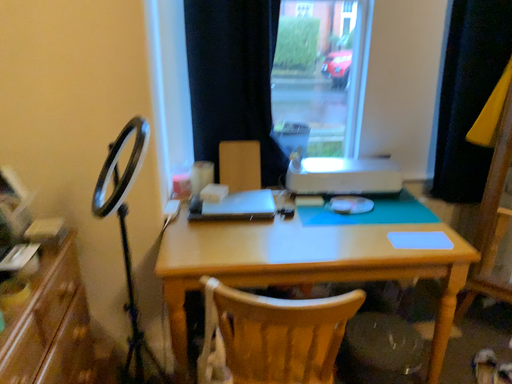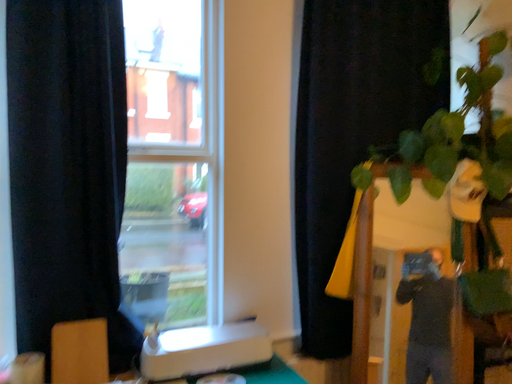
Question: How did the camera likely rotate when shooting the video?

Choices:
 (A) rotated downward
 (B) rotated upward

Answer: (B)